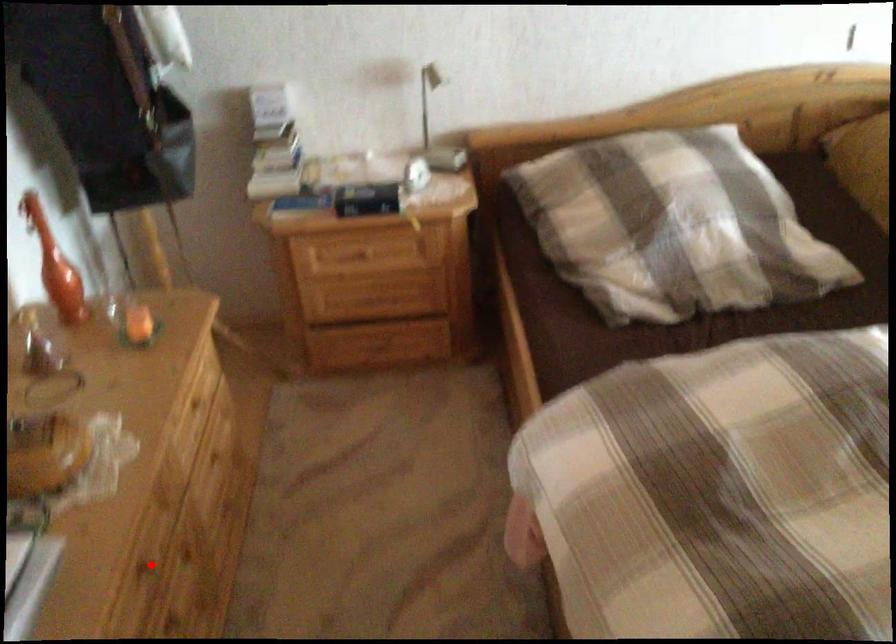
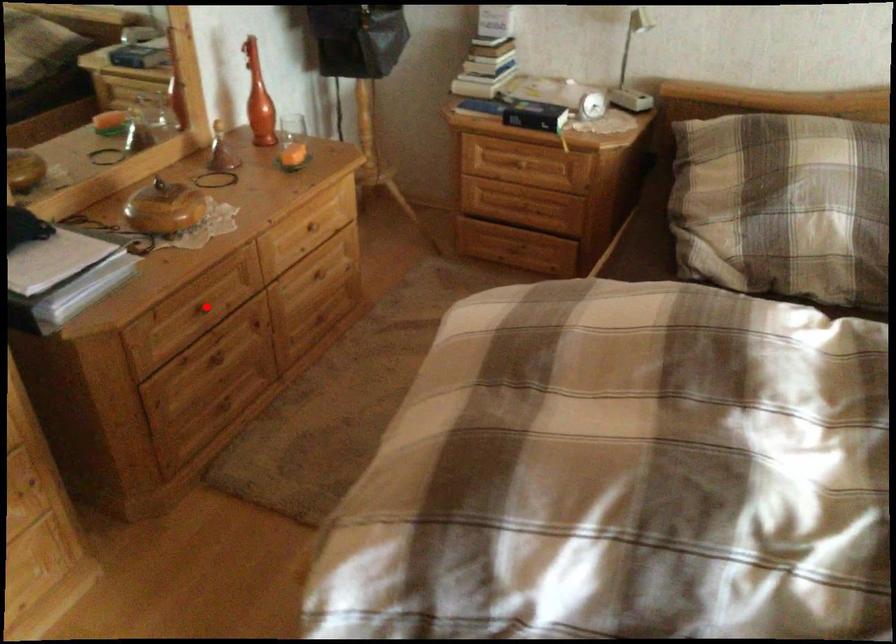
I am providing you with two images of the same scene from different viewpoints. A red point is marked on the first image and another point is marked on the second image. Is the red point in image1 aligned with the point shown in image2?

Yes